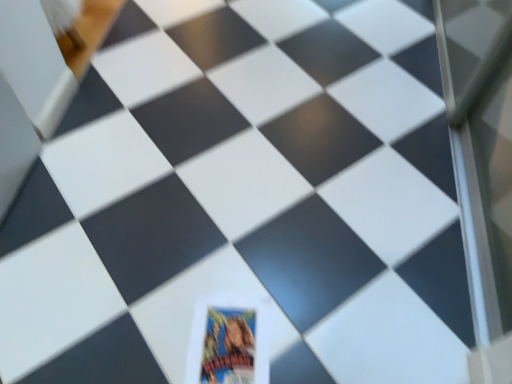
Identify the location of blank area beneath colorful glossy comic book at center (from a real-world perspective). The height and width of the screenshot is (384, 512). (231, 333).